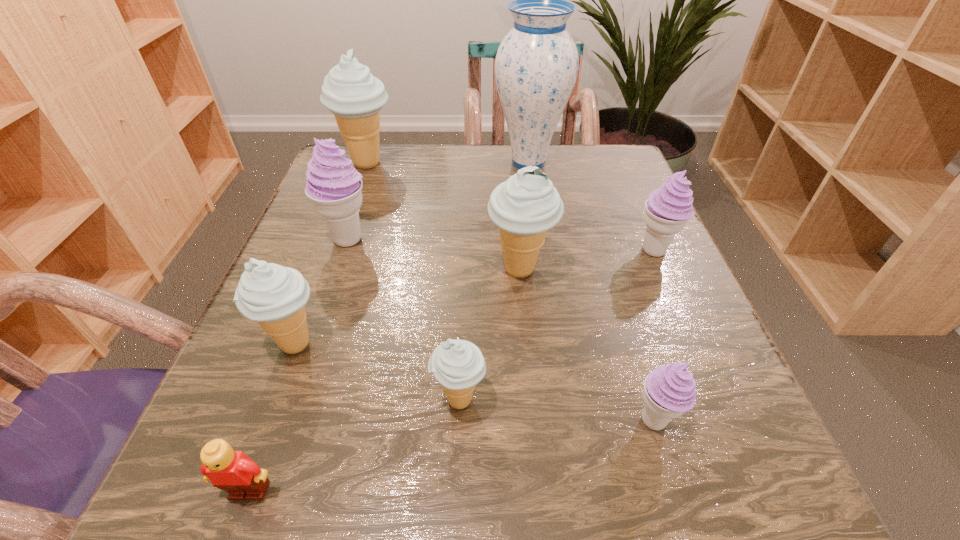
Identify the location of object situated at the far left corner. (349, 91).

Where is `object present at the near left corner`? object present at the near left corner is located at coordinates 233,471.

Identify the location of object that is at the far right corner. (536, 66).

Find the location of a particular element. blank space at the far edge of the desktop is located at coordinates (468, 176).

Identify the location of free space at the near edge. The image size is (960, 540). (621, 487).

Where is `vacant point at the left edge`? vacant point at the left edge is located at coordinates (316, 300).

In the image, there is a desktop. At what (x,y) coordinates should I click in order to perform the action: click on free space at the right edge. Please return your answer as a coordinate pair (x, y). This screenshot has width=960, height=540. Looking at the image, I should click on (588, 210).

At what (x,y) coordinates should I click in order to perform the action: click on free space at the far right corner of the desktop. Please return your answer as a coordinate pair (x, y). This screenshot has height=540, width=960. Looking at the image, I should click on (573, 165).

At what (x,y) coordinates should I click in order to perform the action: click on free spot at the near right corner of the desktop. Please return your answer as a coordinate pair (x, y). Looking at the image, I should click on (736, 522).

What are the coordinates of `empty location between the second smallest beige icecream and the third beige icecream from left to right` in the screenshot? It's located at (377, 372).